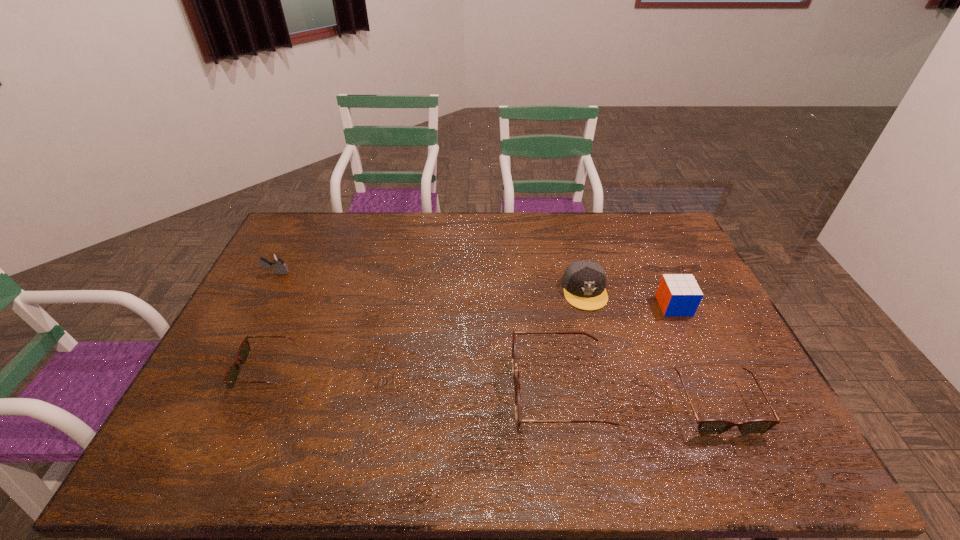
I want to click on free region located at the front view of the tallest spectacles, so point(440,393).

Image resolution: width=960 pixels, height=540 pixels. In order to click on vacant region located 0.120m at the front view of the tallest spectacles in this screenshot , I will do `click(468, 393)`.

Locate an element on the screen. Image resolution: width=960 pixels, height=540 pixels. free region located 0.140m on the back of the igniter is located at coordinates (291, 243).

Locate an element on the screen. The width and height of the screenshot is (960, 540). vacant region located 0.220m on the front-facing side of the cap is located at coordinates [x=605, y=370].

Image resolution: width=960 pixels, height=540 pixels. I want to click on vacant point located on the front of the cube, so click(725, 418).

I want to click on spectacles that is at the left edge, so click(232, 374).

Find the location of a particular element. The height and width of the screenshot is (540, 960). igniter located at the left edge is located at coordinates (277, 262).

The width and height of the screenshot is (960, 540). I want to click on spectacles at the right edge, so click(710, 427).

Locate an element on the screen. The image size is (960, 540). cube that is at the right edge is located at coordinates (678, 294).

You are a GUI agent. You are given a task and a screenshot of the screen. Output one action in this format:
    pyautogui.click(x=<x>, y=<y>)
    Task: Click on the object that is positioned at the near right corner
    The height and width of the screenshot is (540, 960).
    Given the screenshot: What is the action you would take?
    pyautogui.click(x=710, y=427)